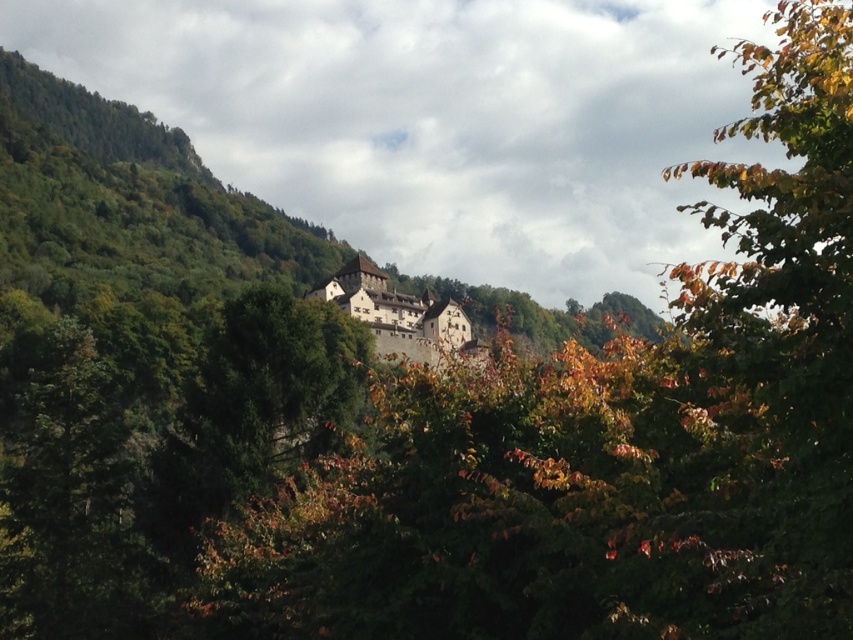
Can you confirm if green matte tree at left is positioned to the right of brown stone castle at center?

No, green matte tree at left is not to the right of brown stone castle at center.

Where is `green matte tree at left`? green matte tree at left is located at coordinates (67, 496).